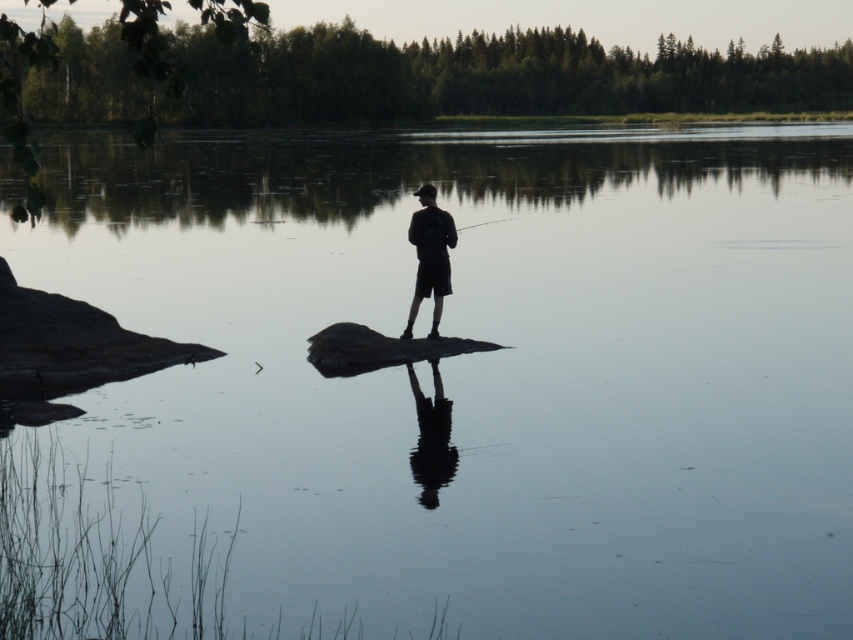
You are an observer trying to determine the relative sizes of objects in the scene. Given that both the black matte shorts at center and the smooth black rod at center are visible, which object appears narrower?

The black matte shorts at center appears narrower since it has a lesser width compared to the smooth black rod at center.

You are a photographer trying to capture the silhouette of the person in the center. The camera has a zoom feature that can focus on a specific coordinate point. According to the coordinates provided, where should you aim the camera to best capture the black matte shorts at center?

The black matte shorts at center is located at point (430, 257), so you should aim the camera at coordinates (430, 257) to best capture the silhouette of the black matte shorts at center.